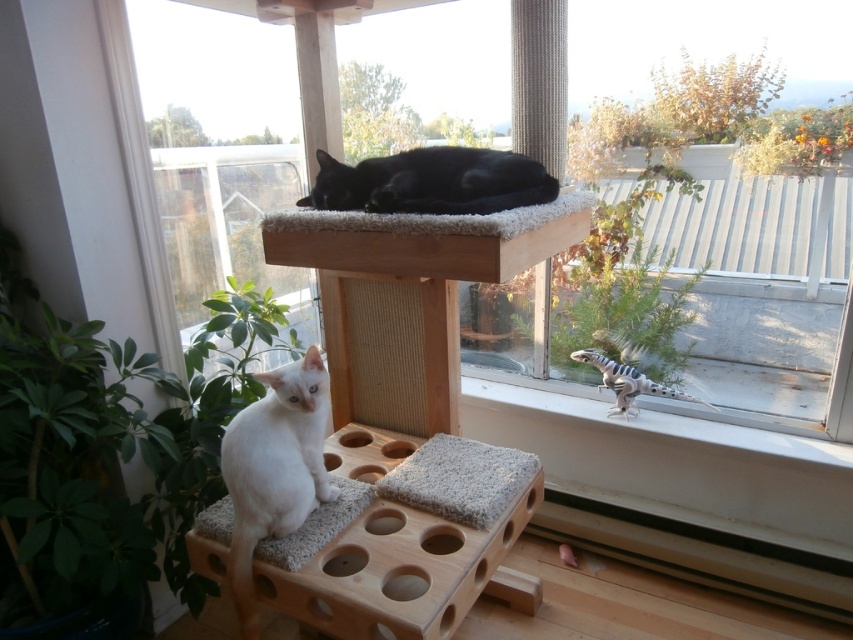
You are a cat owner who wants to take a photo of your two cats, the white fluffy cat at lower left and the black fur cat at upper center. If you want to ensure both cats are fully visible in the photo, which cat should you position closer to the camera?

The white fluffy cat at lower left is already in front of the black fur cat at upper center, so to ensure both are fully visible, position the white fluffy cat at lower left slightly further back so the black fur cat at upper center isn not blocked.

You are a cat owner who wants to ensure both cats can see each other while resting on their respective spots. Given their positions on the cat tree, can the white fluffy cat at lower left and the black fur cat at upper center see each other?

The white fluffy cat at lower left is below the black fur cat at upper center, so they can see each other as their positions allow for line of sight between them.